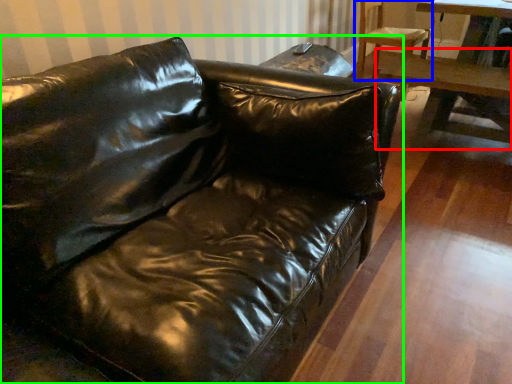
Question: Considering the real-world distances, which object is closest to table (highlighted by a red box)? chair (highlighted by a blue box) or studio couch (highlighted by a green box).

Choices:
 (A) chair
 (B) studio couch

Answer: (A)